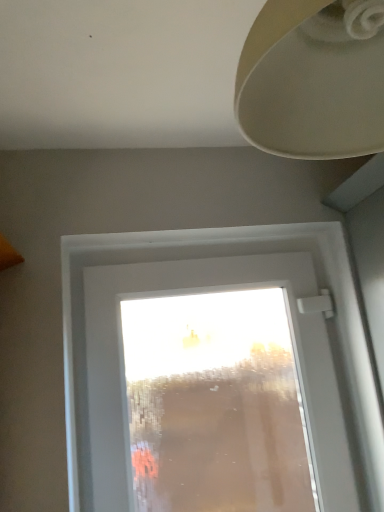
Question: From the image's perspective, is transparent glass window at center below matte beige lampshade at upper right?

Choices:
 (A) yes
 (B) no

Answer: (A)

Question: Can you confirm if transparent glass window at center is positioned to the left of matte beige lampshade at upper right?

Choices:
 (A) no
 (B) yes

Answer: (B)

Question: Does transparent glass window at center touch matte beige lampshade at upper right?

Choices:
 (A) yes
 (B) no

Answer: (B)

Question: Does transparent glass window at center have a greater height compared to matte beige lampshade at upper right?

Choices:
 (A) yes
 (B) no

Answer: (A)

Question: Is transparent glass window at center outside matte beige lampshade at upper right?

Choices:
 (A) yes
 (B) no

Answer: (A)

Question: From a real-world perspective, is transparent glass window at center physically above matte beige lampshade at upper right?

Choices:
 (A) yes
 (B) no

Answer: (B)

Question: Would you say matte beige lampshade at upper right is outside transparent glass window at center?

Choices:
 (A) yes
 (B) no

Answer: (A)

Question: Is matte beige lampshade at upper right closer to camera compared to transparent glass window at center?

Choices:
 (A) no
 (B) yes

Answer: (B)

Question: Is matte beige lampshade at upper right smaller than transparent glass window at center?

Choices:
 (A) yes
 (B) no

Answer: (A)

Question: From the image's perspective, does matte beige lampshade at upper right appear lower than transparent glass window at center?

Choices:
 (A) yes
 (B) no

Answer: (B)

Question: Is matte beige lampshade at upper right beside transparent glass window at center?

Choices:
 (A) yes
 (B) no

Answer: (B)

Question: Could you tell me if matte beige lampshade at upper right is turned towards transparent glass window at center?

Choices:
 (A) yes
 (B) no

Answer: (B)

Question: From a real-world perspective, is matte beige lampshade at upper right positioned above or below transparent glass window at center?

Choices:
 (A) below
 (B) above

Answer: (B)